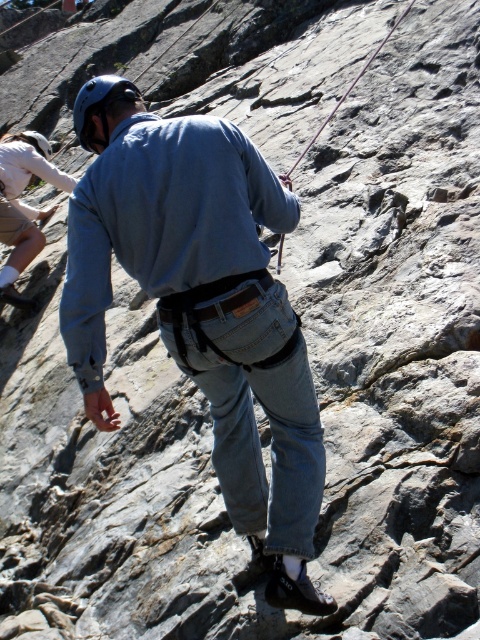
Question: Does denim jeans at center lie behind matte blue helmet at upper left?

Choices:
 (A) no
 (B) yes

Answer: (A)

Question: Which object is positioned closest to the denim jeans at center?

Choices:
 (A) matte blue helmet at upper left
 (B) white cotton shirt at upper left

Answer: (A)

Question: Can you confirm if denim jeans at center is positioned above matte blue helmet at upper left?

Choices:
 (A) yes
 (B) no

Answer: (B)

Question: Is denim jeans at center smaller than white cotton shirt at upper left?

Choices:
 (A) yes
 (B) no

Answer: (B)

Question: Estimate the real-world distances between objects in this image. Which object is closer to the denim jeans at center?

Choices:
 (A) white cotton shirt at upper left
 (B) matte blue helmet at upper left

Answer: (B)

Question: Which point is closer to the camera?

Choices:
 (A) (109, 90)
 (B) (66, 177)

Answer: (A)